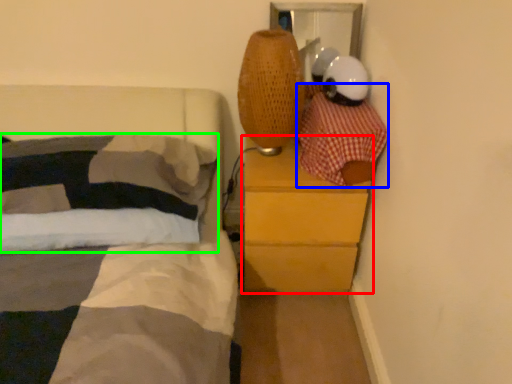
Question: Which object is the closest to the chest of drawers (highlighted by a red box)? Choose among these: blanket (highlighted by a blue box) or pillow (highlighted by a green box).

Choices:
 (A) blanket
 (B) pillow

Answer: (A)